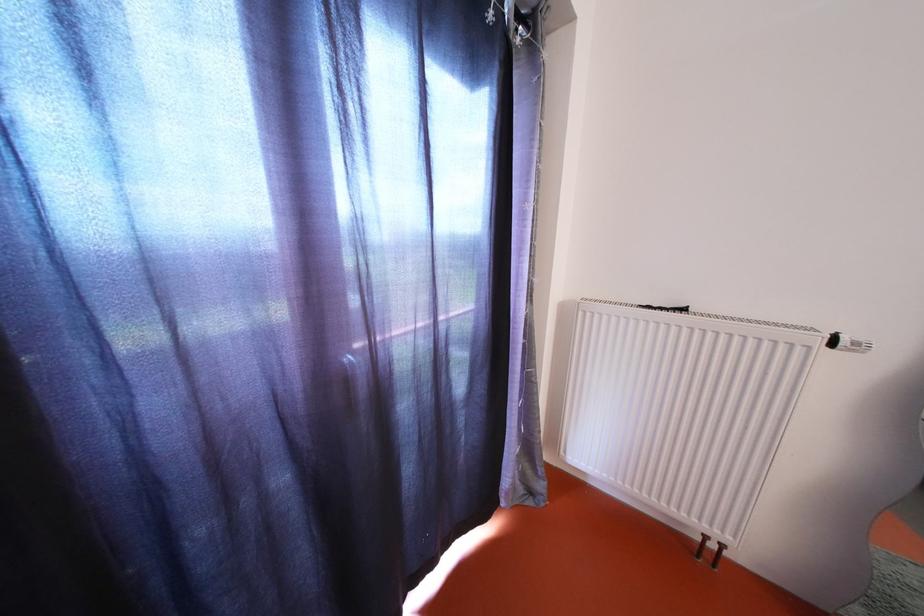
Find where to turn the white radiator valve. Please return your answer as a coordinate pair (x, y).

(847, 342)